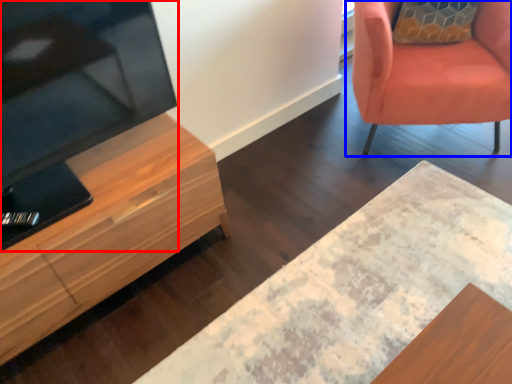
Question: Among these objects, which one is farthest to the camera, television (highlighted by a red box) or chair (highlighted by a blue box)?

Choices:
 (A) television
 (B) chair

Answer: (B)